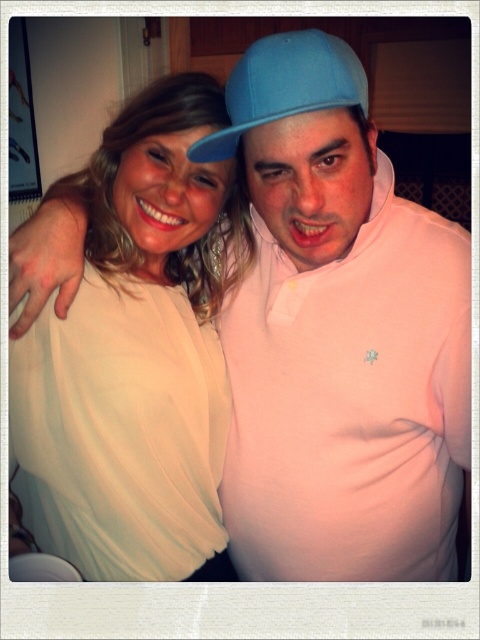
Which is more to the right, matte white blouse at center or matte blue cap at center?

matte blue cap at center is more to the right.

Between matte white blouse at center and matte blue cap at center, which one is positioned higher?

matte blue cap at center is higher up.

You are a GUI agent. You are given a task and a screenshot of the screen. Output one action in this format:
    pyautogui.click(x=<x>, y=<y>)
    Task: Click on the matte white blouse at center
    The image size is (480, 640).
    Given the screenshot: What is the action you would take?
    tap(137, 352)

The height and width of the screenshot is (640, 480). Identify the location of matte white blouse at center. (137, 352).